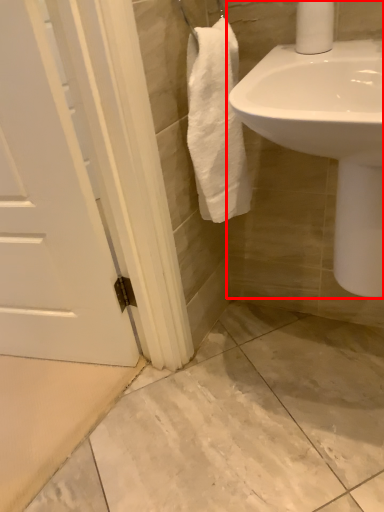
Question: From the image, what is the correct spatial relationship of sink (annotated by the red box) in relation to toilet paper?

Choices:
 (A) right
 (B) left

Answer: (A)